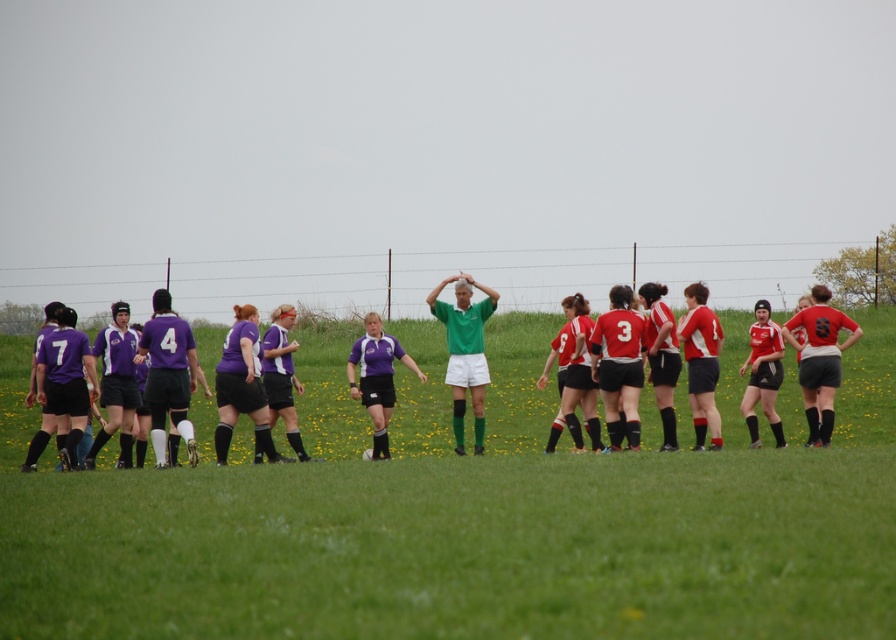
Question: Which point is closer to the camera?

Choices:
 (A) purple jersey at left
 (B) green matte jersey at center

Answer: (A)

Question: Which object appears farthest from the camera in this image?

Choices:
 (A) purple jersey at left
 (B) matte purple jersey at center
 (C) green grass field at center
 (D) green matte jersey at center

Answer: (B)

Question: Is green grass field at center below purple jersey at left?

Choices:
 (A) no
 (B) yes

Answer: (B)

Question: Is green grass field at center below green matte jersey at center?

Choices:
 (A) yes
 (B) no

Answer: (A)

Question: Which object is closer to the camera taking this photo?

Choices:
 (A) green grass field at center
 (B) matte purple jersey at center
 (C) green matte jersey at center

Answer: (A)

Question: Is green grass field at center further to the viewer compared to matte purple jersey at center?

Choices:
 (A) no
 (B) yes

Answer: (A)